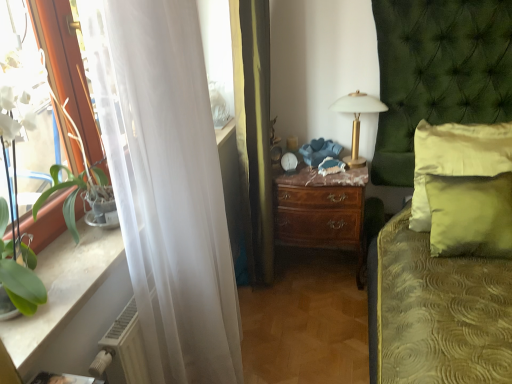
Where is `vacant space in front of brown wood nightstand at center`? The height and width of the screenshot is (384, 512). vacant space in front of brown wood nightstand at center is located at coordinates (321, 313).